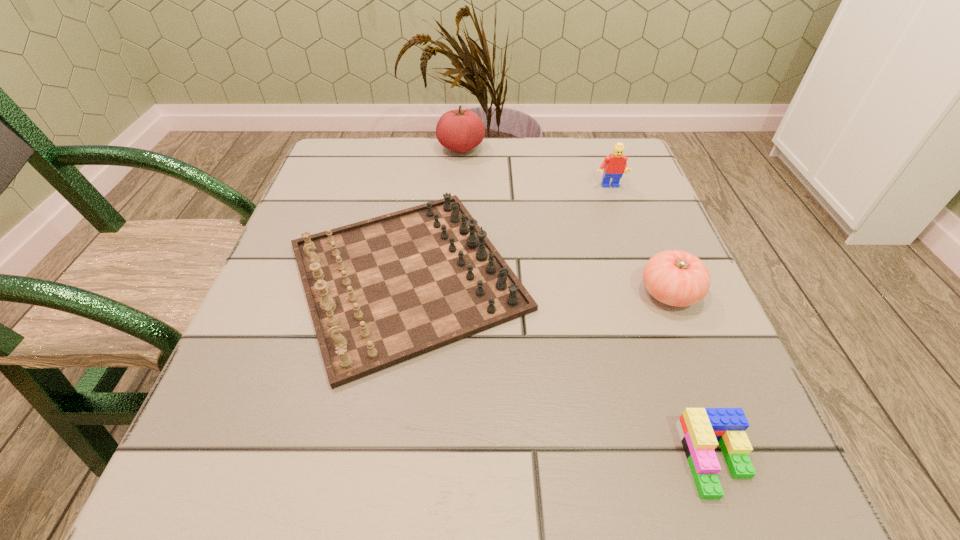
I want to click on object that is at the near right corner, so click(699, 429).

At what (x,y) coordinates should I click in order to perform the action: click on vacant space at the far edge of the desktop. Please return your answer as a coordinate pair (x, y). The image size is (960, 540). Looking at the image, I should click on (x=398, y=161).

The width and height of the screenshot is (960, 540). In the image, there is a desktop. Find the location of `blank space at the near edge`. blank space at the near edge is located at coordinates (579, 470).

In the image, there is a desktop. Find the location of `vacant space at the left edge`. vacant space at the left edge is located at coordinates (324, 207).

This screenshot has width=960, height=540. In the image, there is a desktop. In order to click on vacant space at the right edge in this screenshot , I will do `click(688, 339)`.

At what (x,y) coordinates should I click in order to perform the action: click on vacant region at the far left corner. Please return your answer as a coordinate pair (x, y). Looking at the image, I should click on (339, 145).

You are a GUI agent. You are given a task and a screenshot of the screen. Output one action in this format:
    pyautogui.click(x=<x>, y=<y>)
    Task: Click on the vacant space at the near left corner of the desktop
    
    Given the screenshot: What is the action you would take?
    pyautogui.click(x=292, y=485)

This screenshot has height=540, width=960. What are the coordinates of `free space at the far right corner of the desktop` in the screenshot? It's located at pyautogui.click(x=626, y=137).

This screenshot has width=960, height=540. Identify the location of free region at the near right corner of the desktop. (687, 498).

Find the location of `vacant area between the farther Lego and the chessboard`. vacant area between the farther Lego and the chessboard is located at coordinates (508, 231).